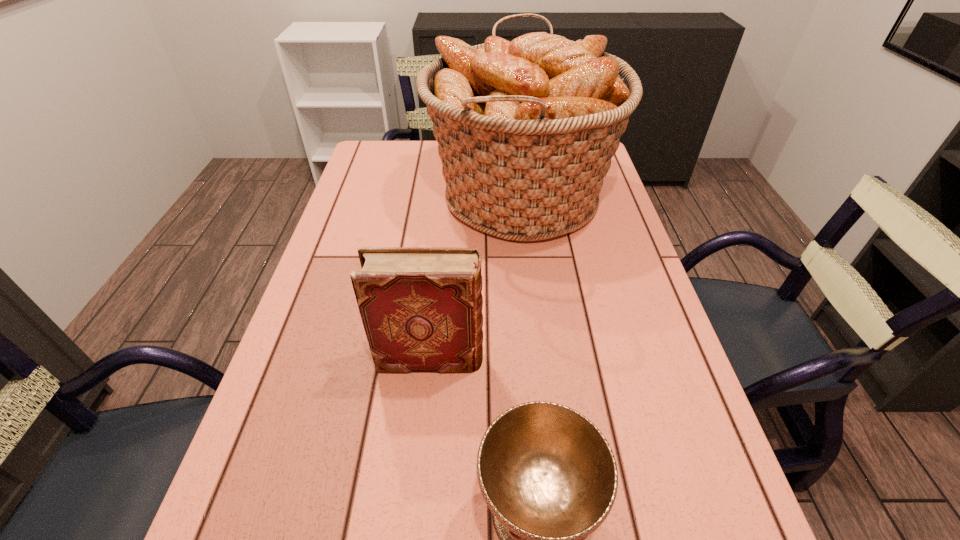
Image resolution: width=960 pixels, height=540 pixels. I want to click on basket, so click(526, 130).

The width and height of the screenshot is (960, 540). I want to click on the tallest object, so click(526, 130).

At what (x,y) coordinates should I click in order to perform the action: click on the second tallest object. Please return your answer as a coordinate pair (x, y). Image resolution: width=960 pixels, height=540 pixels. Looking at the image, I should click on (421, 307).

At what (x,y) coordinates should I click in order to perform the action: click on the second nearest object. Please return your answer as a coordinate pair (x, y). Looking at the image, I should click on (421, 307).

Locate an element on the screen. free space located 0.100m on the front of the tallest object is located at coordinates (531, 292).

Locate an element on the screen. The image size is (960, 540). vacant region located on the spine side of the second shortest object is located at coordinates (594, 359).

This screenshot has height=540, width=960. In order to click on object that is at the far edge in this screenshot , I will do `click(526, 130)`.

This screenshot has width=960, height=540. Identify the location of object that is at the right edge. (526, 130).

Find the location of `object that is positioned at the far right corner`. object that is positioned at the far right corner is located at coordinates (526, 130).

The image size is (960, 540). Find the location of `free region at the left edge of the desktop`. free region at the left edge of the desktop is located at coordinates (344, 232).